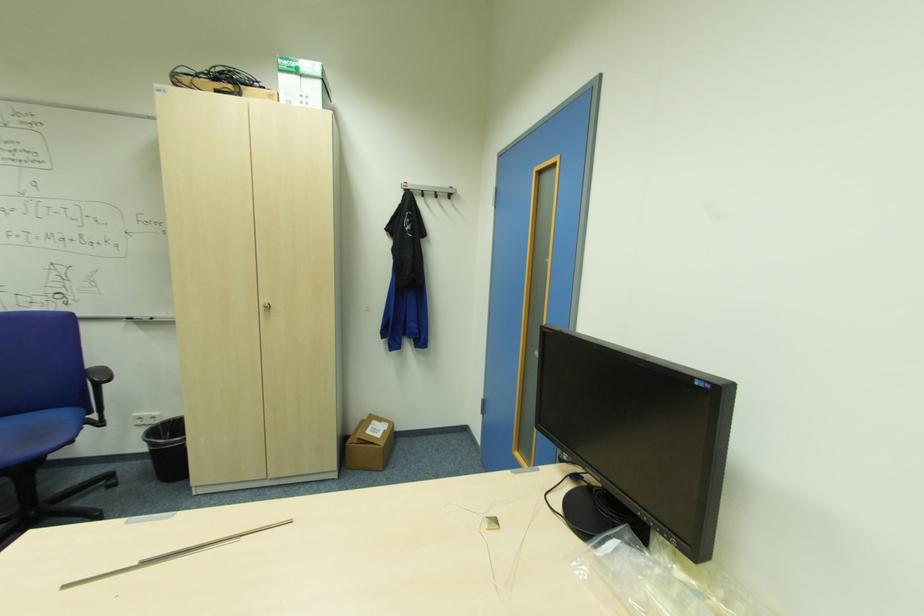
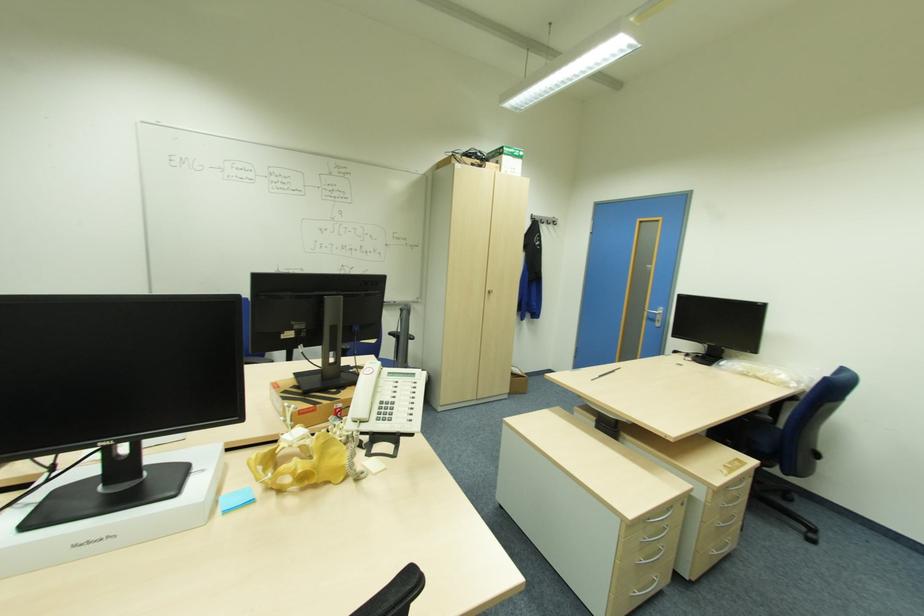
Looking at this image, in a continuous first-person perspective shot, in which direction is the camera moving?

The cameraman moved toward left, backward.